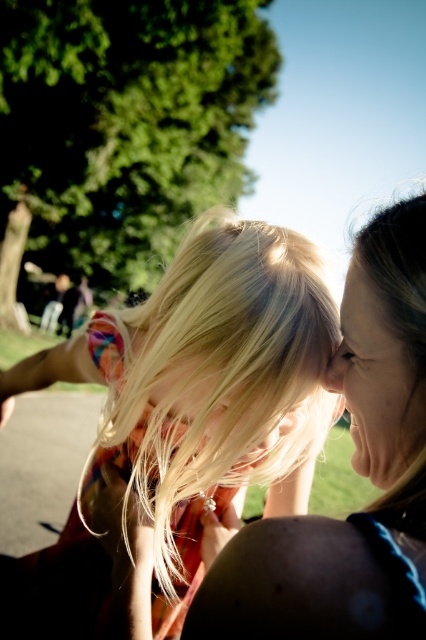
Is point (391, 401) positioned in front of point (342, 392)?

Yes.

The width and height of the screenshot is (426, 640). In order to click on smooth skin face at right in this screenshot , I will do `click(379, 381)`.

Can you confirm if blonde hair at center is shorter than smooth skin nose at center?

No.

The width and height of the screenshot is (426, 640). In order to click on blonde hair at center in this screenshot , I will do click(187, 413).

Between matte black hair at center and smooth skin nose at center, which one is positioned lower?

matte black hair at center is lower down.

Can you confirm if matte black hair at center is positioned below smooth skin nose at center?

Yes, matte black hair at center is below smooth skin nose at center.

Identify the location of matte black hair at center. The image size is (426, 640). (356, 470).